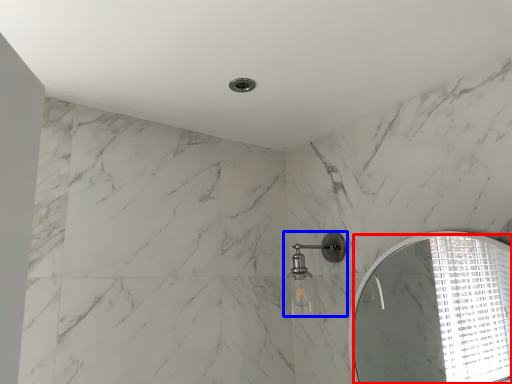
Question: Which object appears farthest to the camera in this image, mirror (highlighted by a red box) or shower (highlighted by a blue box)?

Choices:
 (A) mirror
 (B) shower

Answer: (B)